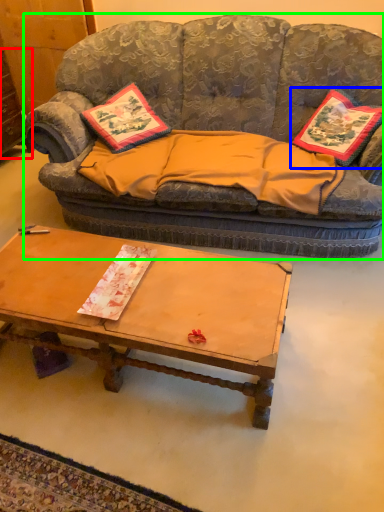
Question: Based on their relative distances, which object is nearer to dresser (highlighted by a red box)? Choose from pillow (highlighted by a blue box) and studio couch (highlighted by a green box).

Choices:
 (A) pillow
 (B) studio couch

Answer: (B)